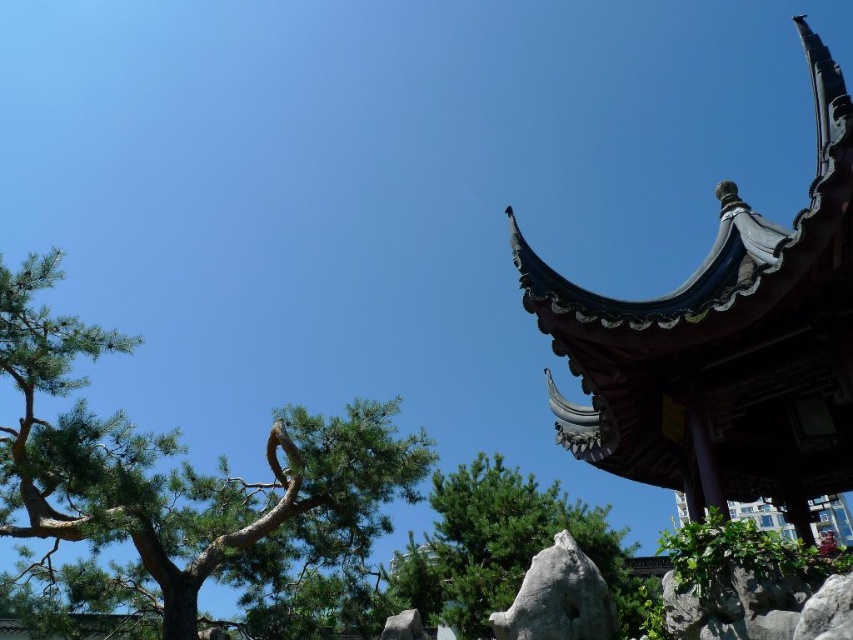
You are standing in the outdoor scene and want to take a photo of the green textured tree at center without the green rough bark tree at upper left blocking it. How should you position yourself?

Move to the right side of the green rough bark tree at upper left so that the green textured tree at center becomes visible behind it.

You are a photographer planning to capture the green rough bark tree at upper left and the gray rough rock at center in a single shot. Given that the camera can only focus on objects within a 2 meter height range, will both objects fit within this range if the tree is 5 meters tall and the rock is 1 meter tall?

The green rough bark tree at upper left is much taller than the gray rough rock at center. Since the tree is 5 meters tall and the rock is 1 meter tall, the height difference is 4 meters, which exceeds the camera focus range of 2 meters. Therefore, both objects cannot be captured in focus within the same shot.

You are standing in the outdoor scene and want to touch both the point at coordinates point (x=438, y=556) and the point at coordinates point (x=556, y=548). Which point will you reach first?

You will reach the point at coordinates point (x=438, y=556) first because it is closer to you than the point at coordinates point (x=556, y=548), which is further away.